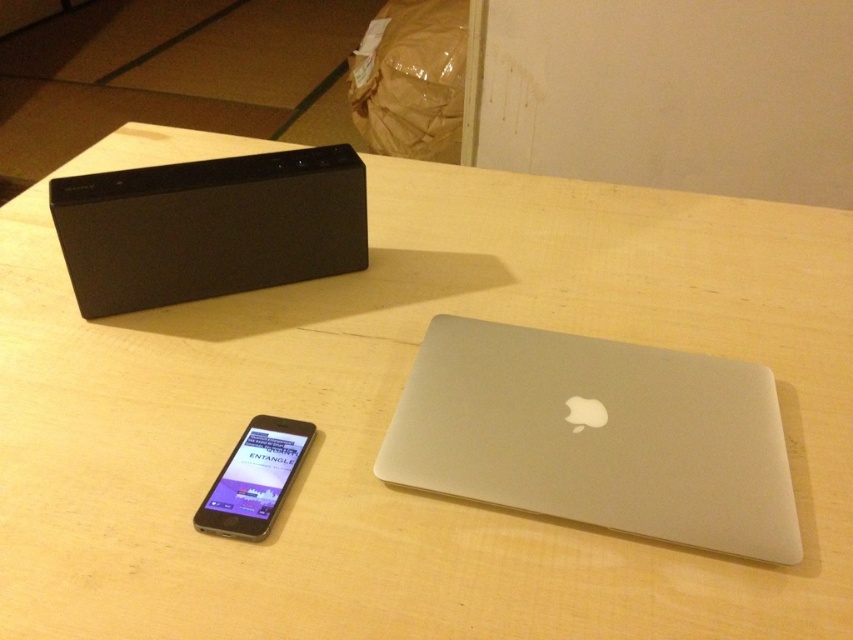
Question: Can you confirm if sleek silver laptop at center is thinner than black matte speaker at upper left?

Choices:
 (A) yes
 (B) no

Answer: (B)

Question: Does sleek silver laptop at center appear on the left side of satin black ipod at lower left?

Choices:
 (A) yes
 (B) no

Answer: (B)

Question: Considering the relative positions of sleek silver laptop at center and satin black ipod at lower left in the image provided, where is sleek silver laptop at center located with respect to satin black ipod at lower left?

Choices:
 (A) right
 (B) left

Answer: (A)

Question: Which of these objects is positioned farthest from the satin black ipod at lower left?

Choices:
 (A) sleek silver laptop at center
 (B) black matte speaker at upper left

Answer: (B)

Question: Among these objects, which one is nearest to the camera?

Choices:
 (A) black matte speaker at upper left
 (B) satin black ipod at lower left
 (C) sleek silver laptop at center

Answer: (C)

Question: Considering the real-world distances, which object is farthest from the sleek silver laptop at center?

Choices:
 (A) black matte speaker at upper left
 (B) satin black ipod at lower left

Answer: (A)